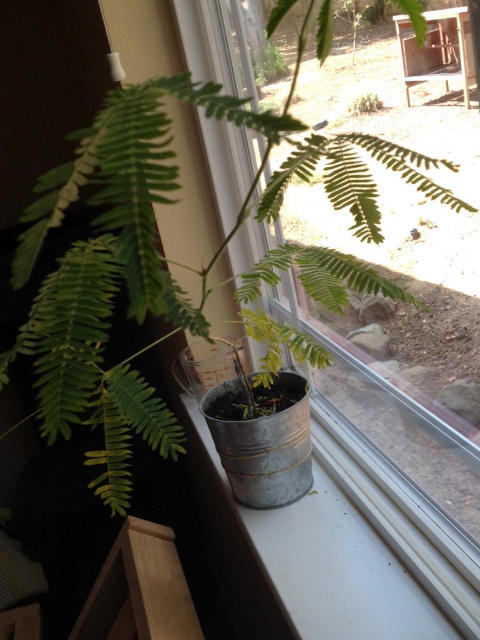
Question: Among these objects, which one is nearest to the camera?

Choices:
 (A) metallic gray window sill at lower left
 (B) metallic bucket at center

Answer: (B)

Question: Can you confirm if metallic bucket at center is wider than metallic gray window sill at lower left?

Choices:
 (A) no
 (B) yes

Answer: (B)

Question: Where is metallic bucket at center located in relation to metallic gray window sill at lower left in the image?

Choices:
 (A) below
 (B) above

Answer: (B)

Question: Does metallic bucket at center come in front of metallic gray window sill at lower left?

Choices:
 (A) no
 (B) yes

Answer: (B)